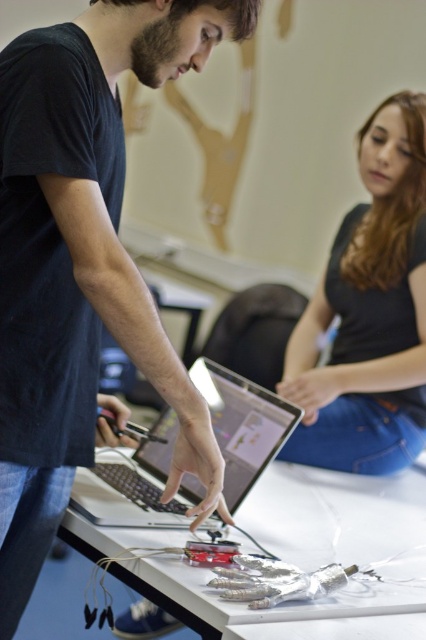
Which of these two, matte black laptop at center or silver metallic laptop at center, stands shorter?

With less height is silver metallic laptop at center.

Consider the image. Does matte black laptop at center have a larger size compared to silver metallic laptop at center?

Yes, matte black laptop at center is bigger than silver metallic laptop at center.

Is point (83, 362) more distant than point (143, 518)?

No, (83, 362) is closer to viewer.

The width and height of the screenshot is (426, 640). What are the coordinates of `matte black laptop at center` in the screenshot? It's located at (81, 260).

From the picture: Can you confirm if matte black laptop at center is positioned above black matte shirt at upper right?

Actually, matte black laptop at center is below black matte shirt at upper right.

From the picture: Can you confirm if matte black laptop at center is positioned below black matte shirt at upper right?

Yes, matte black laptop at center is below black matte shirt at upper right.

This screenshot has width=426, height=640. What do you see at coordinates (81, 260) in the screenshot?
I see `matte black laptop at center` at bounding box center [81, 260].

I want to click on matte black laptop at center, so click(x=81, y=260).

Which is above, black matte shirt at upper right or white plastic table at center?

black matte shirt at upper right

Between point (411, 106) and point (362, 518), which one is positioned behind?

Point (411, 106)

This screenshot has width=426, height=640. I want to click on black matte shirt at upper right, so click(368, 314).